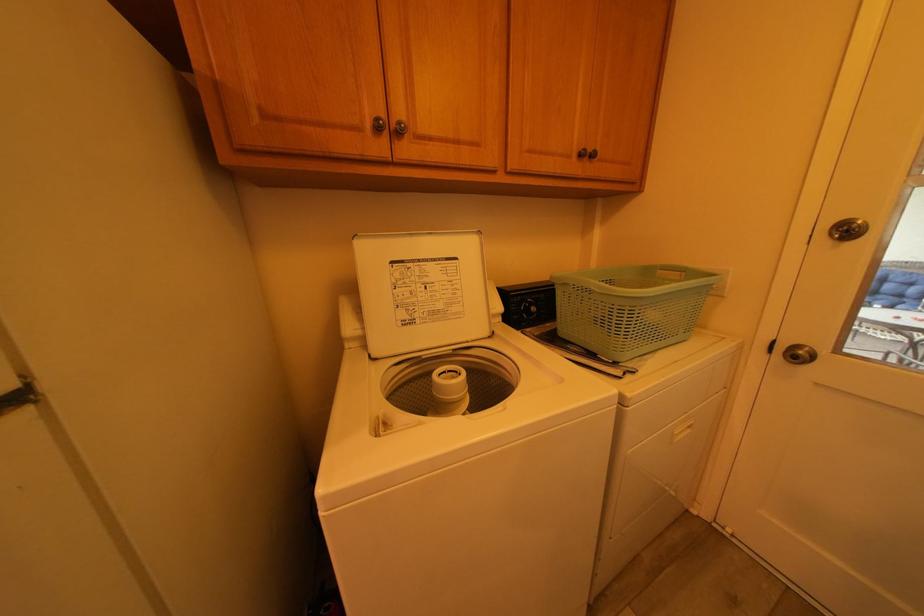
I want to click on blue sofa sitting surface, so click(894, 290).